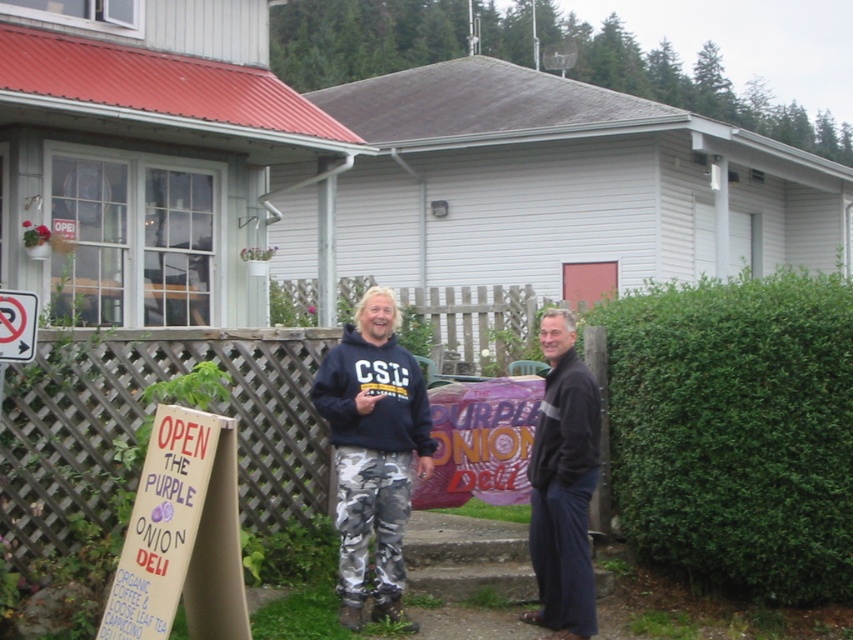
Question: Which is farther from the white plastic sign at upper left?

Choices:
 (A) camouflage pants at center
 (B) dark blue fabric at right
 (C) wooden signboard at lower left

Answer: (B)

Question: Which of the following is the closest to the observer?

Choices:
 (A) (370, 493)
 (B) (378, 564)

Answer: (A)

Question: Does wooden signboard at lower left have a smaller size compared to camo pants at center?

Choices:
 (A) yes
 (B) no

Answer: (A)

Question: Can you confirm if camouflage pants at center is positioned to the right of white plastic sign at upper left?

Choices:
 (A) yes
 (B) no

Answer: (A)

Question: Which object is positioned farthest from the camouflage pants at center?

Choices:
 (A) dark blue fabric at right
 (B) wooden signboard at lower left

Answer: (B)

Question: Does camo pants at center have a lesser width compared to white plastic sign at upper left?

Choices:
 (A) yes
 (B) no

Answer: (B)